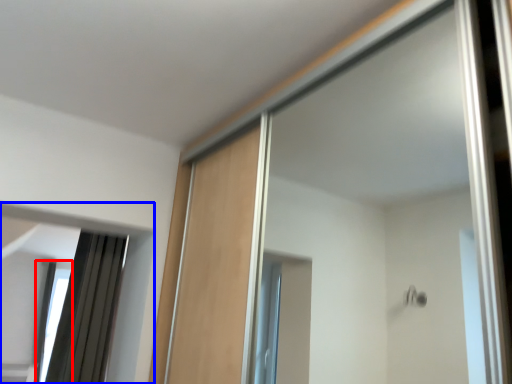
Question: Among these objects, which one is nearest to the camera, window (highlighted by a red box) or mirror (highlighted by a blue box)?

Choices:
 (A) window
 (B) mirror

Answer: (B)